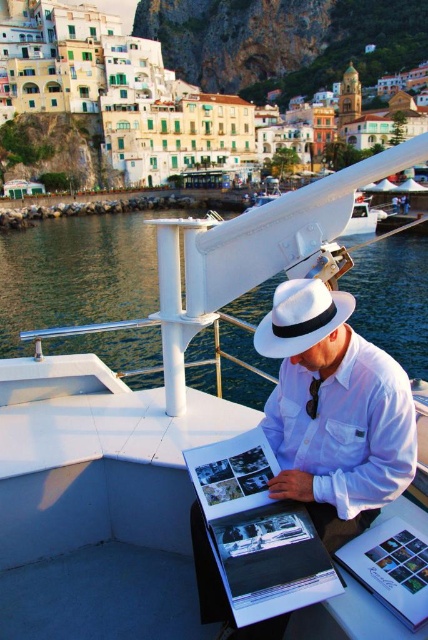
Question: Which object appears farthest from the camera in this image?

Choices:
 (A) white cotton shirt at center
 (B) white felt hat at center
 (C) black satin tie at center

Answer: (C)

Question: Is white felt hat at center smaller than black satin tie at center?

Choices:
 (A) no
 (B) yes

Answer: (A)

Question: Does clear blue water at center have a lesser width compared to black satin tie at center?

Choices:
 (A) yes
 (B) no

Answer: (B)

Question: Which is nearer to the black satin tie at center?

Choices:
 (A) white cotton shirt at center
 (B) clear blue water at center

Answer: (A)

Question: Does clear blue water at center have a smaller size compared to white cotton shirt at center?

Choices:
 (A) yes
 (B) no

Answer: (B)

Question: Estimate the real-world distances between objects in this image. Which object is farther from the clear blue water at center?

Choices:
 (A) white cotton shirt at center
 (B) black satin tie at center

Answer: (B)